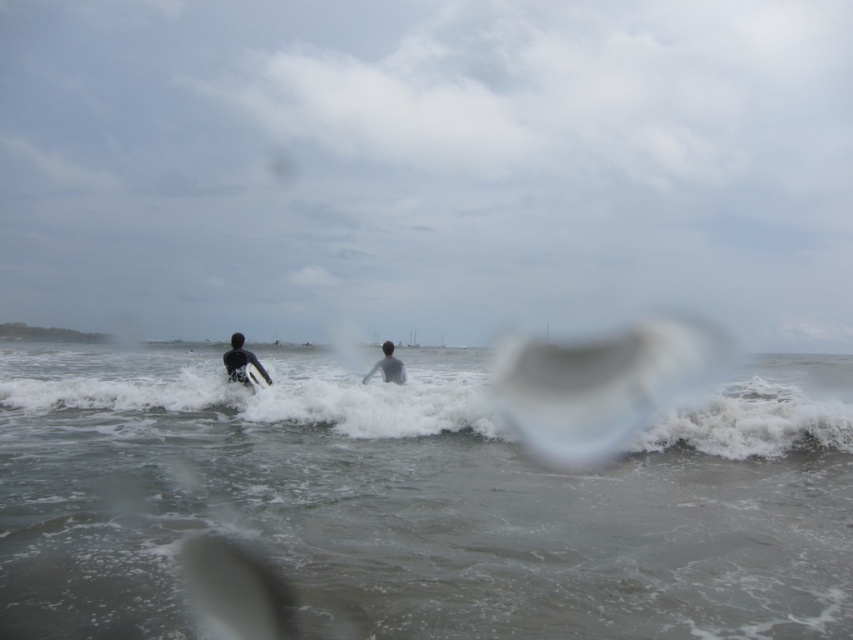
Question: Which point is closer to the camera?

Choices:
 (A) white foamy wave at center
 (B) dark gray wetsuit at left
 (C) white foam surfboard at center
 (D) dark gray wetsuit at center

Answer: (A)

Question: Is dark gray wetsuit at center positioned before white foam surfboard at center?

Choices:
 (A) no
 (B) yes

Answer: (A)

Question: From the image, what is the correct spatial relationship of gray matte water at center in relation to white foamy wave at center?

Choices:
 (A) right
 (B) left

Answer: (B)

Question: Is gray matte water at center to the right of white foam surfboard at center from the viewer's perspective?

Choices:
 (A) yes
 (B) no

Answer: (A)

Question: Among these objects, which one is nearest to the camera?

Choices:
 (A) gray matte water at center
 (B) dark gray wetsuit at center
 (C) white foam surfboard at center

Answer: (A)

Question: Estimate the real-world distances between objects in this image. Which object is farther from the dark gray wetsuit at center?

Choices:
 (A) white foam surfboard at center
 (B) gray matte water at center
 (C) white foamy wave at center
 (D) dark gray wetsuit at left

Answer: (C)